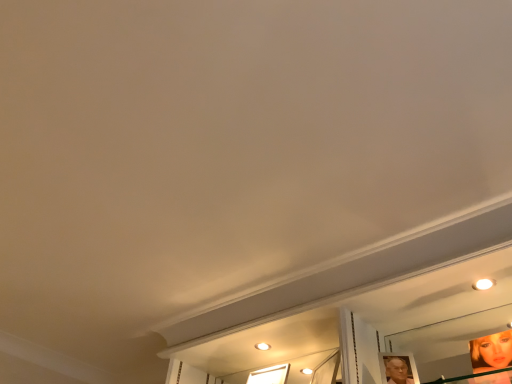
What do you see at coordinates (269, 375) in the screenshot? I see `transparent glass window at center` at bounding box center [269, 375].

Find the location of a particular element. This screenshot has height=384, width=512. transparent glass window at center is located at coordinates (269, 375).

Find the location of `shiny gold mirror at lower right`. shiny gold mirror at lower right is located at coordinates (448, 342).

The height and width of the screenshot is (384, 512). What do you see at coordinates (448, 342) in the screenshot?
I see `shiny gold mirror at lower right` at bounding box center [448, 342].

Where is `transparent glass window at center`? This screenshot has height=384, width=512. transparent glass window at center is located at coordinates (269, 375).

Considering the relative positions of shiny gold mirror at lower right and transparent glass window at center in the image provided, is shiny gold mirror at lower right to the right of transparent glass window at center from the viewer's perspective?

Yes.

Is shiny gold mirror at lower right in front of or behind transparent glass window at center in the image?

shiny gold mirror at lower right is positioned closer to the viewer than transparent glass window at center.

Is point (442, 363) positioned behind point (270, 375)?

Yes, point (442, 363) is farther from viewer.

From the image's perspective, who appears lower, shiny gold mirror at lower right or transparent glass window at center?

transparent glass window at center.

From a real-world perspective, who is located higher, shiny gold mirror at lower right or transparent glass window at center?

In real-world perspective, transparent glass window at center is above.

Is shiny gold mirror at lower right thinner than transparent glass window at center?

Yes, shiny gold mirror at lower right is thinner than transparent glass window at center.

From the picture: In terms of height, does shiny gold mirror at lower right look taller or shorter compared to transparent glass window at center?

Clearly, shiny gold mirror at lower right is taller compared to transparent glass window at center.

Which of these two, shiny gold mirror at lower right or transparent glass window at center, is smaller?

transparent glass window at center.

Is shiny gold mirror at lower right not within transparent glass window at center?

Absolutely, shiny gold mirror at lower right is external to transparent glass window at center.

Would you say shiny gold mirror at lower right is a long distance from transparent glass window at center?

They are positioned close to each other.

From the picture: Could you tell me if shiny gold mirror at lower right is turned towards transparent glass window at center?

No, shiny gold mirror at lower right is not aimed at transparent glass window at center.

How different are the orientations of shiny gold mirror at lower right and transparent glass window at center in degrees?

5.51 degrees.

Measure the distance between shiny gold mirror at lower right and transparent glass window at center.

28.88 inches.

Locate an element on the screen. The height and width of the screenshot is (384, 512). window that is on the left side of shiny gold mirror at lower right is located at coordinates (269, 375).

Can you confirm if transparent glass window at center is positioned to the right of shiny gold mirror at lower right?

No, transparent glass window at center is not to the right of shiny gold mirror at lower right.

Between transparent glass window at center and shiny gold mirror at lower right, which one is positioned in front?

shiny gold mirror at lower right is more forward.

Is point (265, 368) positioned in front of point (495, 331)?

No.

From the image's perspective, which is below, transparent glass window at center or shiny gold mirror at lower right?

transparent glass window at center.

From a real-world perspective, is transparent glass window at center physically located above or below shiny gold mirror at lower right?

In terms of real-world spatial position, transparent glass window at center is above shiny gold mirror at lower right.

Considering the sizes of transparent glass window at center and shiny gold mirror at lower right in the image, is transparent glass window at center wider or thinner than shiny gold mirror at lower right?

transparent glass window at center is wider than shiny gold mirror at lower right.

Between transparent glass window at center and shiny gold mirror at lower right, which one has less height?

Standing shorter between the two is transparent glass window at center.

In the scene shown: Considering the relative sizes of transparent glass window at center and shiny gold mirror at lower right in the image provided, is transparent glass window at center smaller than shiny gold mirror at lower right?

Correct, transparent glass window at center occupies less space than shiny gold mirror at lower right.

Which is correct: transparent glass window at center is inside shiny gold mirror at lower right, or outside of it?

transparent glass window at center is not enclosed by shiny gold mirror at lower right.

Is transparent glass window at center far away from shiny gold mirror at lower right?

transparent glass window at center is actually quite close to shiny gold mirror at lower right.

Is transparent glass window at center facing away from shiny gold mirror at lower right?

transparent glass window at center is not turned away from shiny gold mirror at lower right.

What's the angular difference between transparent glass window at center and shiny gold mirror at lower right's facing directions?

There is a 5.51-degree angle between the facing directions of transparent glass window at center and shiny gold mirror at lower right.

How much distance is there between transparent glass window at center and shiny gold mirror at lower right?

transparent glass window at center and shiny gold mirror at lower right are 73.35 centimeters apart.

Where is `window located below the shiny gold mirror at lower right (from the image's perspective)`? This screenshot has height=384, width=512. window located below the shiny gold mirror at lower right (from the image's perspective) is located at coordinates (269, 375).

Find the location of a particular element. window on the left of the shiny gold mirror at lower right is located at coordinates (269, 375).

Where is `mirror in front of the transparent glass window at center`? The image size is (512, 384). mirror in front of the transparent glass window at center is located at coordinates (448, 342).